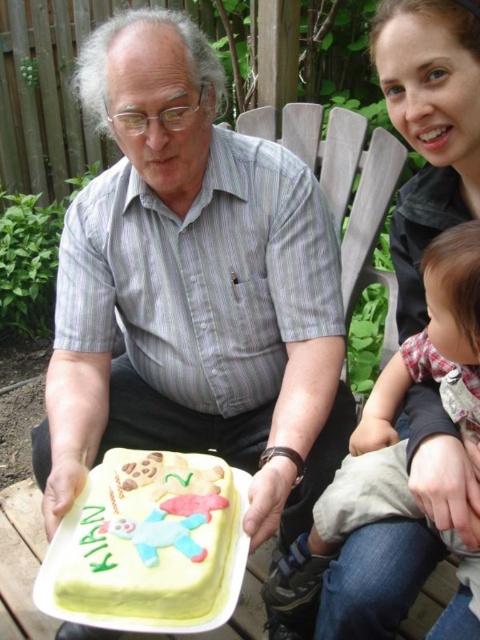
Question: Can you confirm if yellow fondant cake at center is positioned above fluffy pink fabric at lower right?

Choices:
 (A) no
 (B) yes

Answer: (B)

Question: Which of these objects is positioned closest to the matte yellow cake at center?

Choices:
 (A) fluffy pink fabric at lower right
 (B) yellow fondant cake at center

Answer: (B)

Question: Which object is positioned farthest from the matte black shirt at upper center?

Choices:
 (A) yellow fondant cake at center
 (B) fluffy pink fabric at lower right
 (C) matte yellow cake at center

Answer: (C)

Question: Does matte black shirt at upper center have a greater width compared to fluffy pink fabric at lower right?

Choices:
 (A) no
 (B) yes

Answer: (A)

Question: Where is matte yellow cake at center located in relation to matte black shirt at upper center in the image?

Choices:
 (A) below
 (B) above

Answer: (A)

Question: Which object is the closest to the matte black shirt at upper center?

Choices:
 (A) fluffy pink fabric at lower right
 (B) matte yellow cake at center
 (C) yellow fondant cake at center

Answer: (A)